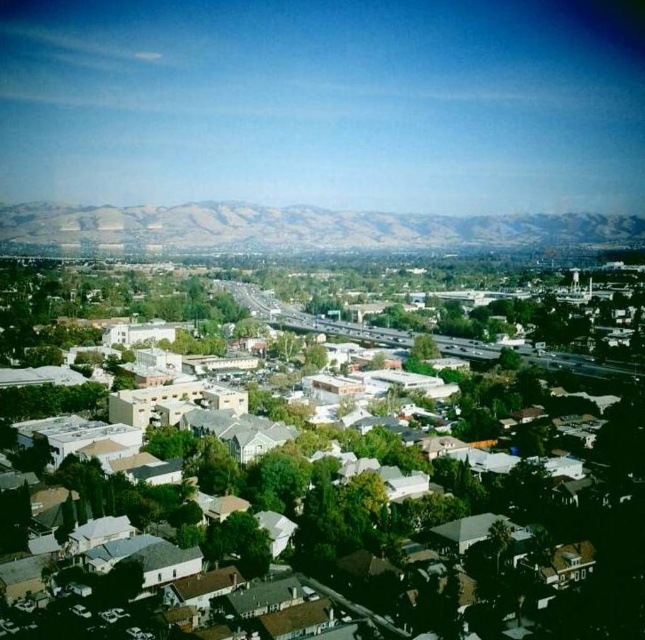
You are standing at the point with coordinates point [477,241] and want to walk to the point with coordinates point [639,513]. Given the suburban scene described, will you have to walk through any houses or green areas along the way?

Since point [639,513] is in front of point [477,241], you would be walking towards it without needing to go through any houses or green areas as the path is clear in the suburban layout described.

Based on the provided coordinates, can you identify which object is positioned at point (453, 516) in the suburban scene?

The white matte houses at center are located at point (453, 516).